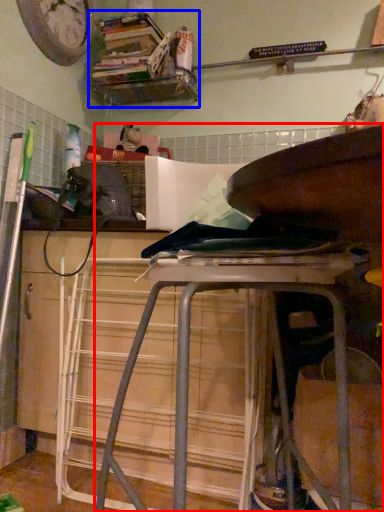
Question: Which object appears farthest to the camera in this image, furniture (highlighted by a red box) or shelf (highlighted by a blue box)?

Choices:
 (A) furniture
 (B) shelf

Answer: (B)